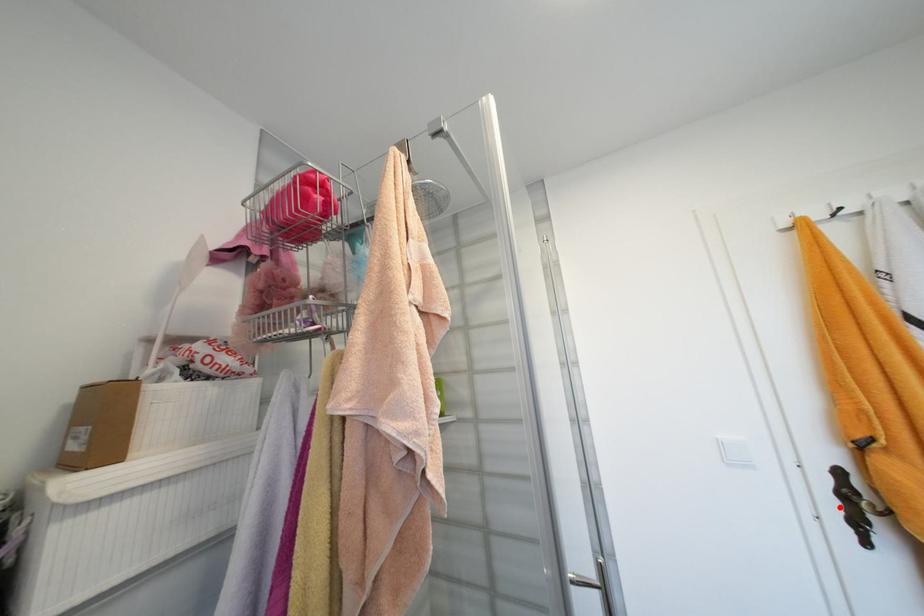
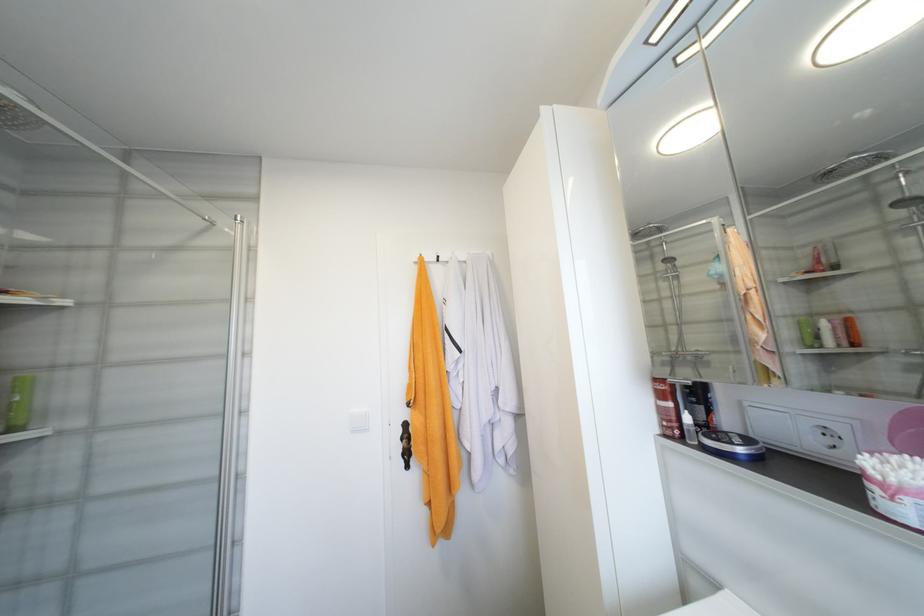
Find the pixel in the second image that matches the highlighted location in the first image.

(405, 448)